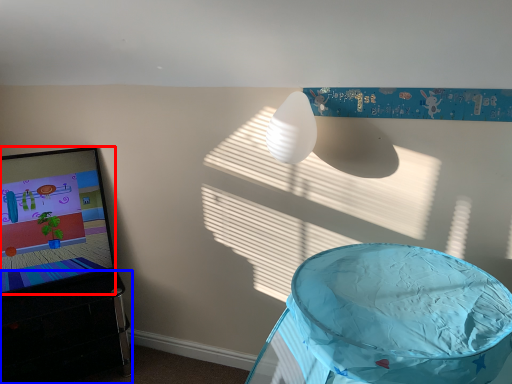
Question: Which object is closer to the camera taking this photo, computer screen (highlighted by a red box) or furniture (highlighted by a blue box)?

Choices:
 (A) computer screen
 (B) furniture

Answer: (B)